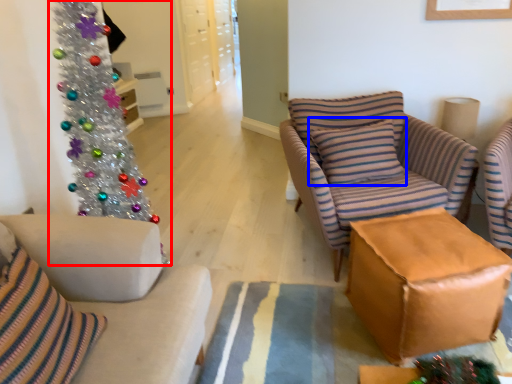
Question: Which point is further to the camera, christmas tree (highlighted by a red box) or pillow (highlighted by a blue box)?

Choices:
 (A) christmas tree
 (B) pillow

Answer: (B)